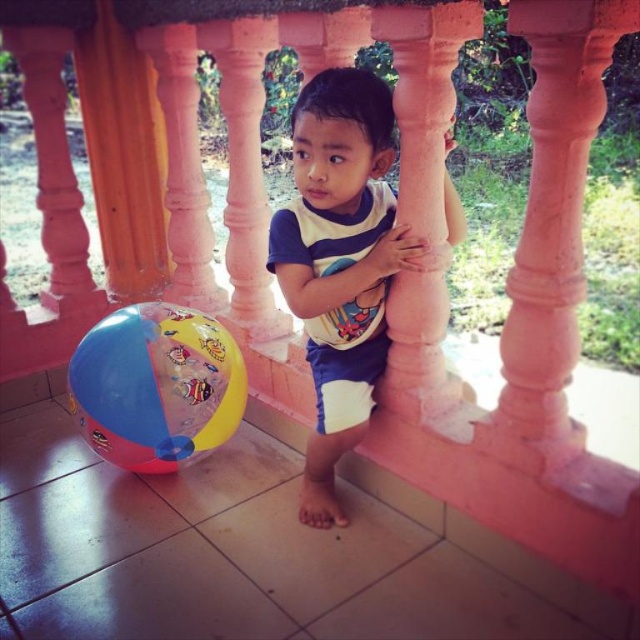
You are a photographer trying to capture the scene with the child and the beach ball. The white cotton shirt at center is part of the child. Where should you position your camera to ensure both the child and the beach ball are in the frame?

The white cotton shirt at center is part of the child, so positioning the camera to include the child naturally includes the beach ball to the left, ensuring both are in the frame.